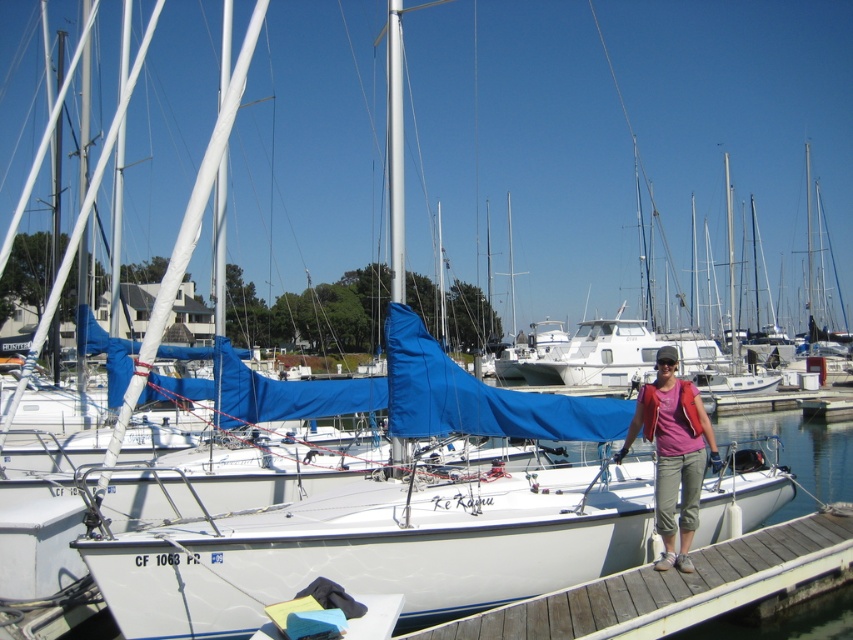
Question: Where is wooden at lower right located in relation to matte pink shirt at center in the image?

Choices:
 (A) left
 (B) right

Answer: (B)

Question: Observing the image, what is the correct spatial positioning of wooden at lower right in reference to matte pink shirt at center?

Choices:
 (A) below
 (B) above

Answer: (A)

Question: Which point appears farthest from the camera in this image?

Choices:
 (A) (682, 536)
 (B) (506, 612)

Answer: (A)

Question: Can you confirm if wooden at lower right is thinner than matte pink shirt at center?

Choices:
 (A) yes
 (B) no

Answer: (B)

Question: Among these points, which one is farthest from the camera?

Choices:
 (A) (680, 429)
 (B) (700, 561)

Answer: (B)